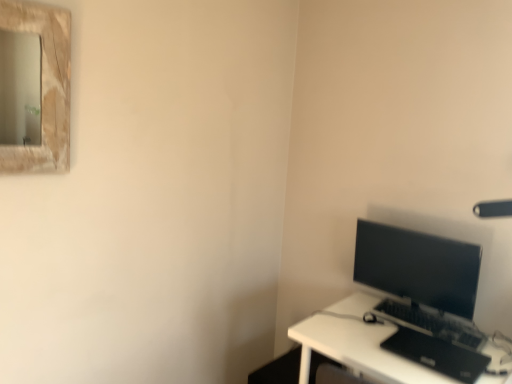
Locate an element on the screen. free space above black plastic keyboard at lower right (from a real-world perspective) is located at coordinates (435, 317).